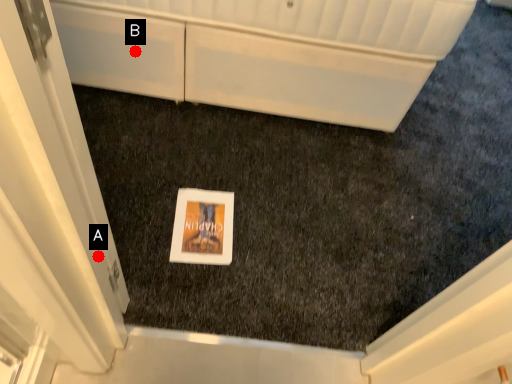
Question: Two points are circled on the image, labeled by A and B beside each circle. Which point is closer to the camera?

Choices:
 (A) A is closer
 (B) B is closer

Answer: (A)